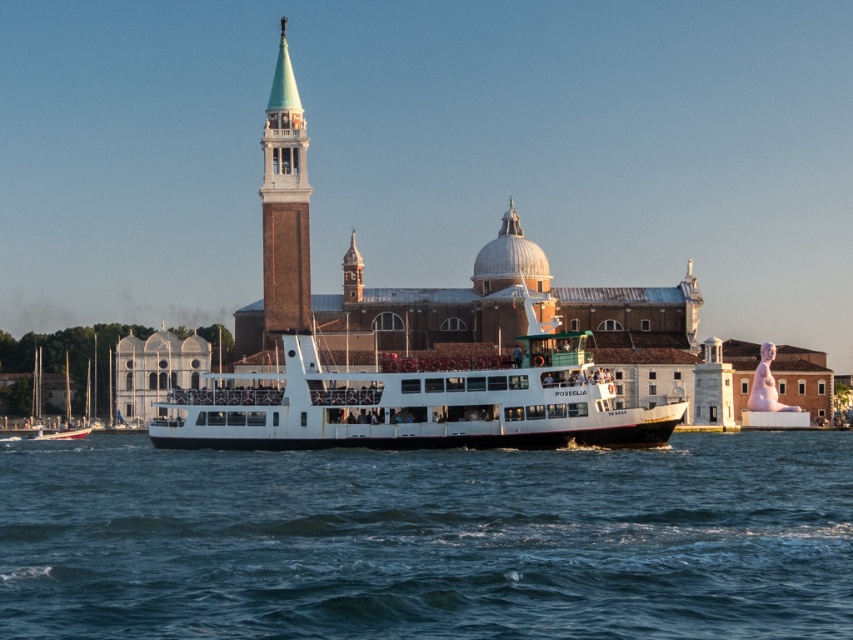
Does blue water at center have a greater width compared to green brick tower at upper center?

→ Correct, the width of blue water at center exceeds that of green brick tower at upper center.

Who is shorter, blue water at center or green brick tower at upper center?

With less height is blue water at center.

Which is behind, point (564, 634) or point (288, 237)?

The point (288, 237) is behind.

At what (x,y) coordinates should I click in order to perform the action: click on blue water at center. Please return your answer as a coordinate pair (x, y). Looking at the image, I should click on (428, 540).